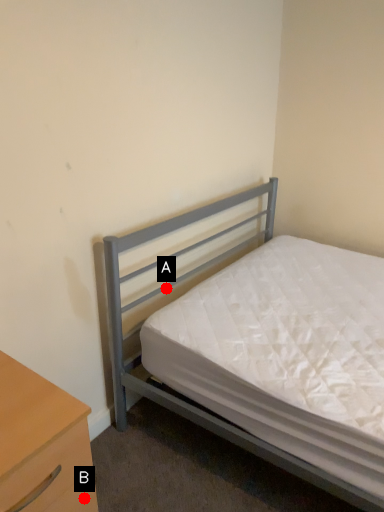
Question: Two points are circled on the image, labeled by A and B beside each circle. Which point is further to the camera?

Choices:
 (A) A is further
 (B) B is further

Answer: (A)